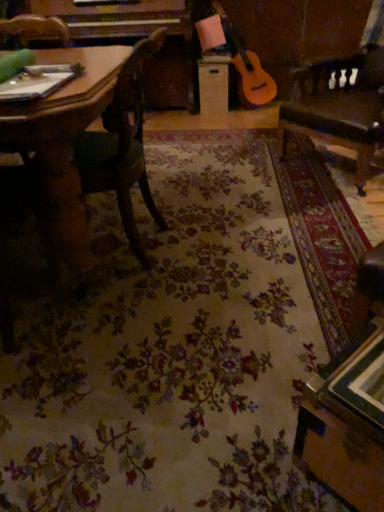
Question: Is wooden chair at left turned away from leather swivel chair at right?

Choices:
 (A) no
 (B) yes

Answer: (A)

Question: Is wooden chair at left oriented towards leather swivel chair at right?

Choices:
 (A) yes
 (B) no

Answer: (B)

Question: Can you confirm if wooden chair at left is shorter than leather swivel chair at right?

Choices:
 (A) no
 (B) yes

Answer: (B)

Question: Is wooden chair at left positioned before leather swivel chair at right?

Choices:
 (A) yes
 (B) no

Answer: (A)

Question: From a real-world perspective, is wooden chair at left physically below leather swivel chair at right?

Choices:
 (A) no
 (B) yes

Answer: (B)

Question: Can you confirm if wooden chair at left is wider than leather swivel chair at right?

Choices:
 (A) no
 (B) yes

Answer: (A)

Question: Does leather swivel chair at right have a smaller size compared to wooden chair at left?

Choices:
 (A) yes
 (B) no

Answer: (B)

Question: Is leather swivel chair at right next to wooden chair at left?

Choices:
 (A) yes
 (B) no

Answer: (B)

Question: From the image's perspective, would you say leather swivel chair at right is positioned over wooden chair at left?

Choices:
 (A) no
 (B) yes

Answer: (B)

Question: Could you tell me if leather swivel chair at right is turned towards wooden chair at left?

Choices:
 (A) yes
 (B) no

Answer: (A)

Question: Can you confirm if leather swivel chair at right is positioned to the left of wooden chair at left?

Choices:
 (A) no
 (B) yes

Answer: (A)

Question: Is wooden chair at left surrounded by leather swivel chair at right?

Choices:
 (A) yes
 (B) no

Answer: (B)

Question: Considering the relative sizes of wooden drawer at center and wooden chair at left in the image provided, is wooden drawer at center taller than wooden chair at left?

Choices:
 (A) yes
 (B) no

Answer: (B)